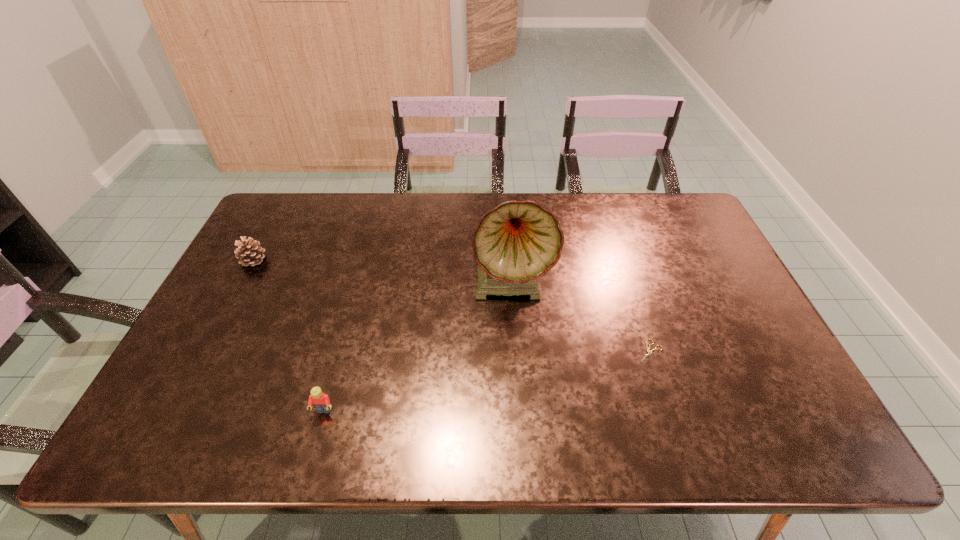
The width and height of the screenshot is (960, 540). Identify the location of record player. (516, 243).

You are a GUI agent. You are given a task and a screenshot of the screen. Output one action in this format:
    pyautogui.click(x=<x>, y=<y>)
    Task: Click on the third object from left to right
    The width and height of the screenshot is (960, 540).
    Given the screenshot: What is the action you would take?
    pyautogui.click(x=516, y=243)

The height and width of the screenshot is (540, 960). I want to click on pinecone, so click(249, 252).

The width and height of the screenshot is (960, 540). I want to click on Lego, so click(321, 402).

This screenshot has height=540, width=960. Identify the location of the second object from left to right. (321, 402).

Locate an element on the screen. The image size is (960, 540). the rightmost object is located at coordinates (648, 349).

At what (x,y) coordinates should I click in order to perform the action: click on the shortest object. Please return your answer as a coordinate pair (x, y). This screenshot has width=960, height=540. Looking at the image, I should click on (648, 349).

Image resolution: width=960 pixels, height=540 pixels. What are the coordinates of `free region located 0.300m from the horn of the record player` in the screenshot? It's located at (520, 418).

Locate an element on the screen. The height and width of the screenshot is (540, 960). free space located 0.180m on the right of the leftmost object is located at coordinates (324, 260).

I want to click on vacant position located 0.070m on the face of the Lego, so click(314, 447).